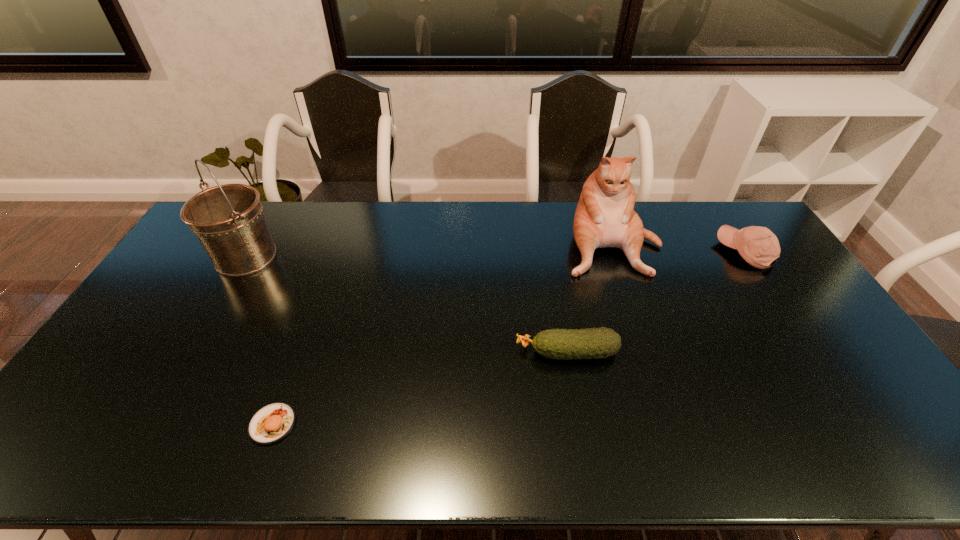
This screenshot has width=960, height=540. I want to click on the leftmost object, so click(228, 220).

Locate an element on the screen. This screenshot has width=960, height=540. cat is located at coordinates (604, 217).

Where is `baseball cap`? Image resolution: width=960 pixels, height=540 pixels. baseball cap is located at coordinates (758, 246).

The width and height of the screenshot is (960, 540). I want to click on the rightmost object, so click(758, 246).

Locate an element on the screen. The image size is (960, 540). the fourth farthest object is located at coordinates (592, 343).

The height and width of the screenshot is (540, 960). I want to click on the second shortest object, so click(592, 343).

Where is `patty`? patty is located at coordinates (271, 423).

You are a GUI agent. You are given a task and a screenshot of the screen. Output one action in this format:
    pyautogui.click(x=<x>, y=<y>)
    Task: Click on the second object from left to right
    The width and height of the screenshot is (960, 540).
    Given the screenshot: What is the action you would take?
    pyautogui.click(x=271, y=423)

At what (x,y) coordinates should I click in order to perform the action: click on vacant space located on the right of the leftmost object. Please return your answer as a coordinate pair (x, y). This screenshot has height=540, width=960. Looking at the image, I should click on (370, 257).

The height and width of the screenshot is (540, 960). Find the location of `vacant space located on the face of the cat`. vacant space located on the face of the cat is located at coordinates (644, 340).